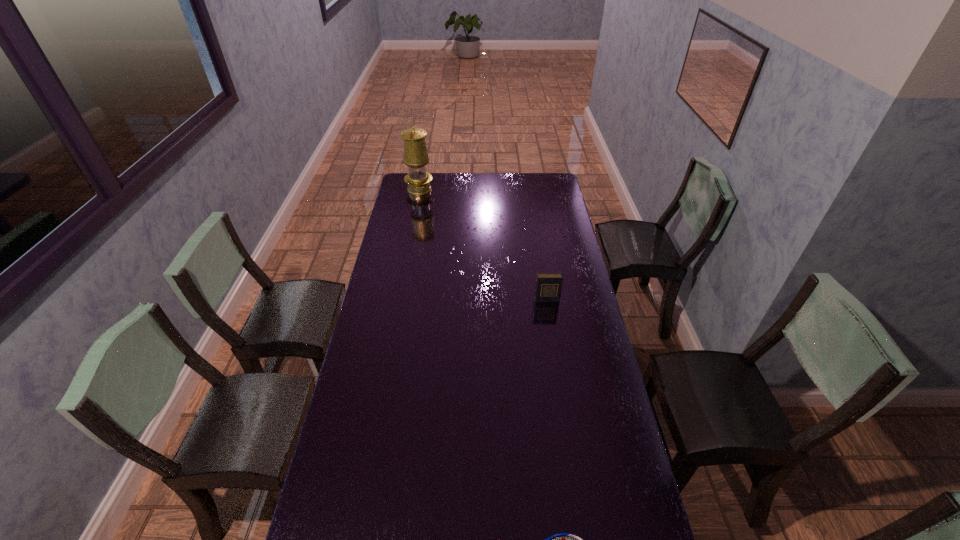
Image resolution: width=960 pixels, height=540 pixels. Find the location of `free region at the far edge`. free region at the far edge is located at coordinates (479, 183).

The image size is (960, 540). What are the coordinates of `vacant region at the left edge of the desktop` in the screenshot? It's located at (408, 314).

This screenshot has width=960, height=540. Find the location of `vacant area at the right edge`. vacant area at the right edge is located at coordinates (551, 218).

Locate an element on the screen. Image resolution: width=960 pixels, height=540 pixels. free space between the second farthest object and the leftmost object is located at coordinates (483, 244).

The height and width of the screenshot is (540, 960). Identify the location of empty space between the oil lamp and the second farthest object. (483, 244).

Where is `empty location between the diary and the tallest object`? empty location between the diary and the tallest object is located at coordinates (483, 244).

Image resolution: width=960 pixels, height=540 pixels. I want to click on object that stands as the closest to the second shortest object, so (x=563, y=539).

Locate which object ranks second in proximity to the second farthest object. Please provide its 2D coordinates. Your answer should be formatted as a tuple, i.e. [(x, y)], where the tuple contains the x and y coordinates of a point satisfying the conditions above.

[(416, 157)]